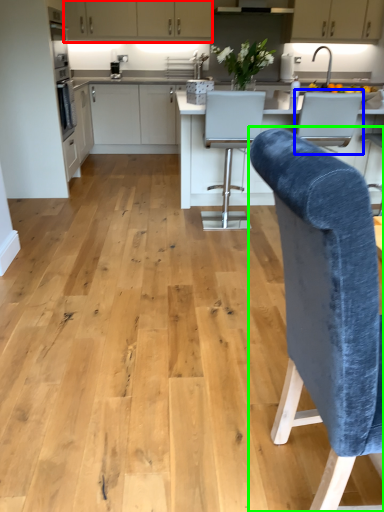
Question: Based on their relative distances, which object is farther from cabinetry (highlighted by a red box)? Choose from armchair (highlighted by a blue box) and chair (highlighted by a green box).

Choices:
 (A) armchair
 (B) chair

Answer: (B)